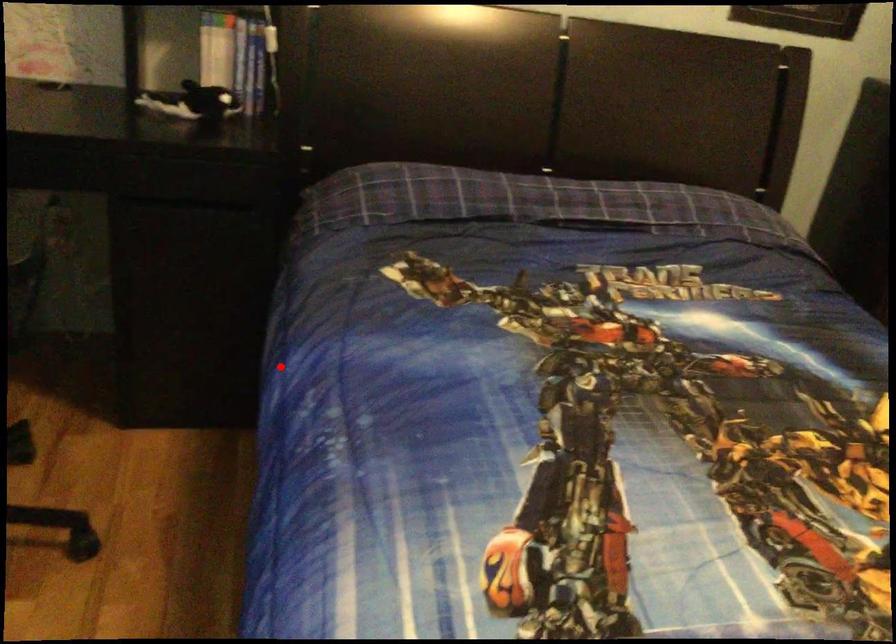
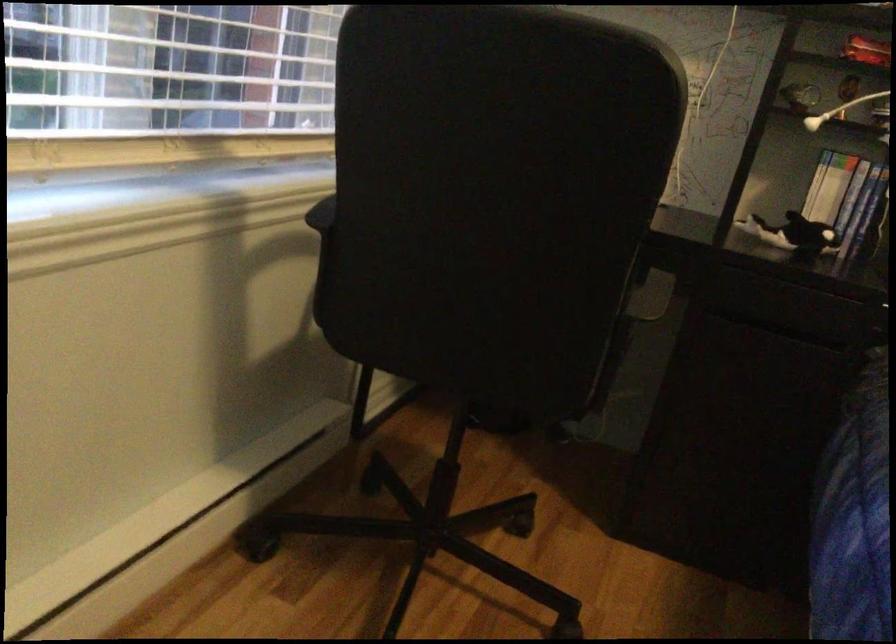
Question: I am providing you with two images of the same scene from different viewpoints. A red point is shown in image1. For the corresponding object point in image2, is it positioned nearer or farther from the camera?

Choices:
 (A) Nearer
 (B) Farther

Answer: (A)